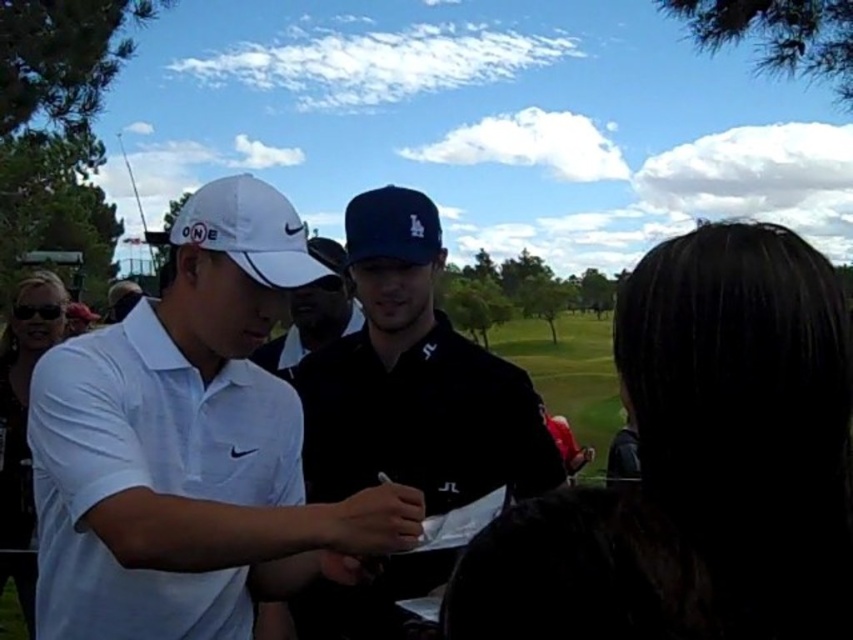
You are a photographer at the golf event and need to ensure both the matte black sunglasses at left and the white matte baseball cap at left are visible in your photo. Given their sizes, which object might require you to zoom in more to capture details?

The matte black sunglasses at left occupies less space than the white matte baseball cap at left, so you might need to zoom in more to capture details of the matte black sunglasses at left since it is smaller.

Looking at the scene described, which object is positioned to the right of the other between the matte black sunglasses at left and the white matte baseball cap at left?

The matte black sunglasses at left are positioned to the right of the white matte baseball cap at left.

You are a photographer at the golf event and want to capture a clear shot of both the white matte shirt at center and the matte black cap at center. Given that the camera can only focus on objects within a 10 cm depth range, will you be able to focus on both objects simultaneously?

The white matte shirt at center is closer to the viewer than the matte black cap at center. Since the camera can only focus on objects within a 10 cm depth range, if the distance between the two objects exceeds 10 cm, the camera won